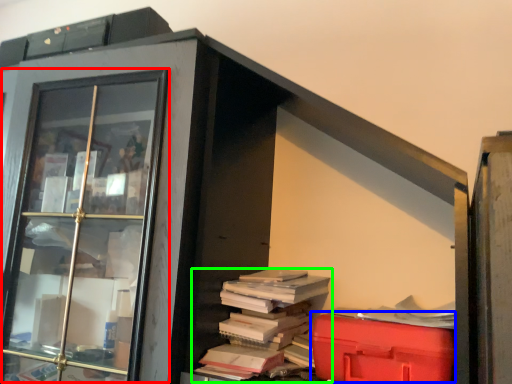
Question: Which object is positioned farthest from glass door (highlighted by a red box)? Select from waste (highlighted by a blue box) and book (highlighted by a green box).

Choices:
 (A) waste
 (B) book

Answer: (A)